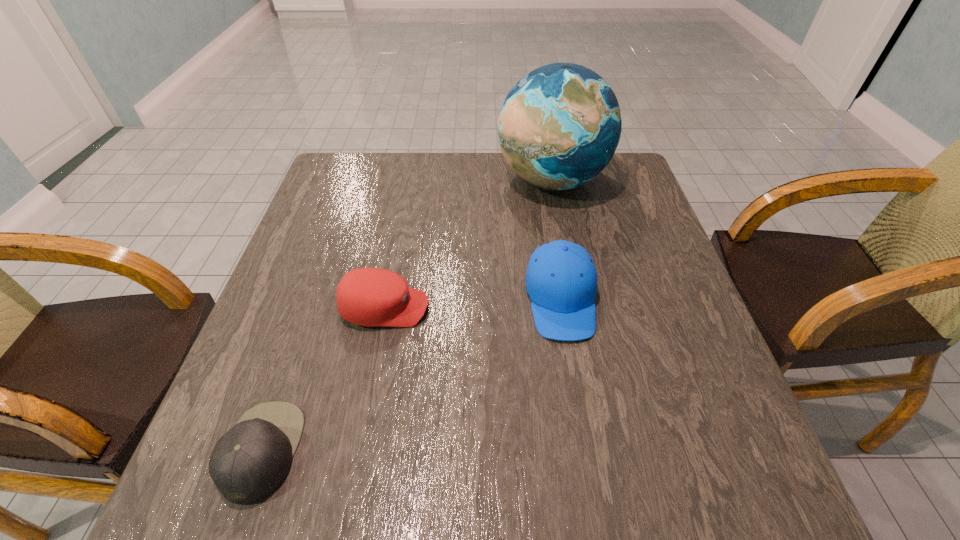
Image resolution: width=960 pixels, height=540 pixels. What are the coordinates of `the farthest object` in the screenshot? It's located at (559, 127).

I want to click on globe, so coord(559,127).

The image size is (960, 540). What are the coordinates of `the tallest cap` in the screenshot? It's located at (561, 280).

Find the location of a particular element. This screenshot has width=960, height=540. the rightmost cap is located at coordinates (561, 280).

Where is `the third object from right to left`? Image resolution: width=960 pixels, height=540 pixels. the third object from right to left is located at coordinates (369, 297).

Find the location of a particular element. the leftmost object is located at coordinates (250, 461).

I want to click on the nearest cap, so click(x=250, y=461).

This screenshot has height=540, width=960. Identify the location of free space located on the front of the tallest object. (577, 307).

Find the location of a particular element. The image size is (960, 540). free space located on the front-facing side of the rightmost cap is located at coordinates (580, 409).

Where is `vacant point located on the front-facing side of the second cap from right to left`? This screenshot has width=960, height=540. vacant point located on the front-facing side of the second cap from right to left is located at coordinates [509, 308].